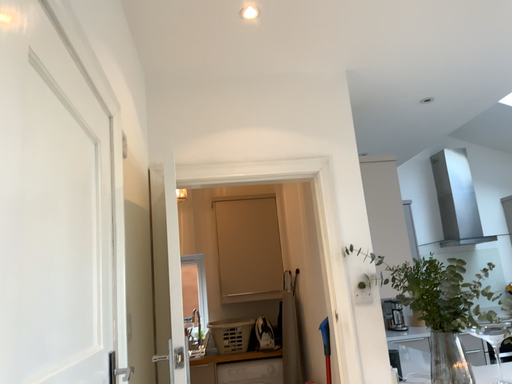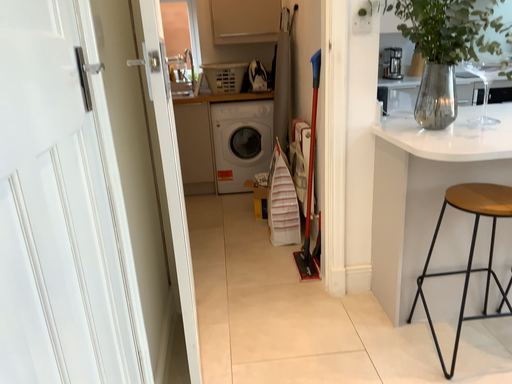
Question: Which way did the camera rotate in the video?

Choices:
 (A) rotated upward
 (B) rotated downward

Answer: (B)